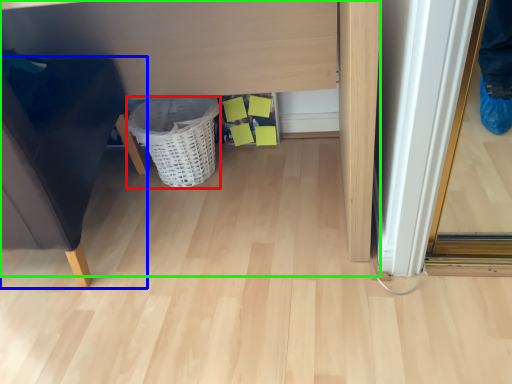
Question: Which object is positioned farthest from basket (highlighted by a red box)? Select from furniture (highlighted by a blue box) and vanity (highlighted by a green box).

Choices:
 (A) furniture
 (B) vanity

Answer: (A)